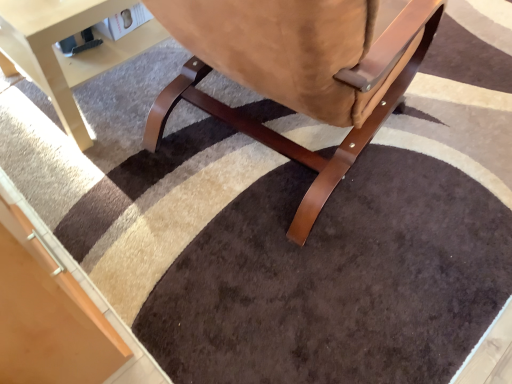
Question: Is suede-like brown chair at center inside light beige wood table at lower left?

Choices:
 (A) yes
 (B) no

Answer: (B)

Question: Can you confirm if light beige wood table at lower left is bigger than suede-like brown chair at center?

Choices:
 (A) no
 (B) yes

Answer: (A)

Question: Is light beige wood table at lower left behind suede-like brown chair at center?

Choices:
 (A) no
 (B) yes

Answer: (B)

Question: Is light beige wood table at lower left facing towards suede-like brown chair at center?

Choices:
 (A) no
 (B) yes

Answer: (A)

Question: Considering the relative sizes of light beige wood table at lower left and suede-like brown chair at center in the image provided, is light beige wood table at lower left wider than suede-like brown chair at center?

Choices:
 (A) no
 (B) yes

Answer: (A)

Question: From the image's perspective, is light beige wood table at lower left located above suede-like brown chair at center?

Choices:
 (A) no
 (B) yes

Answer: (B)

Question: From a real-world perspective, is suede-like brown chair at center beneath light beige wood table at lower left?

Choices:
 (A) no
 (B) yes

Answer: (A)

Question: Can you confirm if suede-like brown chair at center is positioned to the left of light beige wood table at lower left?

Choices:
 (A) yes
 (B) no

Answer: (B)

Question: Considering the relative sizes of suede-like brown chair at center and light beige wood table at lower left in the image provided, is suede-like brown chair at center wider than light beige wood table at lower left?

Choices:
 (A) no
 (B) yes

Answer: (B)

Question: From a real-world perspective, is suede-like brown chair at center over light beige wood table at lower left?

Choices:
 (A) yes
 (B) no

Answer: (A)

Question: From the image's perspective, would you say suede-like brown chair at center is positioned over light beige wood table at lower left?

Choices:
 (A) no
 (B) yes

Answer: (A)

Question: Does suede-like brown chair at center have a larger size compared to light beige wood table at lower left?

Choices:
 (A) yes
 (B) no

Answer: (A)

Question: Does point (288, 155) appear closer or farther from the camera than point (106, 13)?

Choices:
 (A) closer
 (B) farther

Answer: (B)